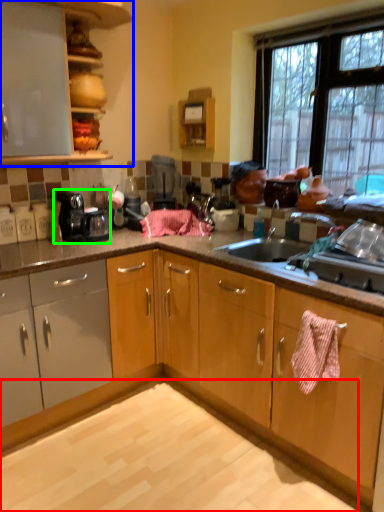
Question: Considering the real-world distances, which object is farthest from granite (highlighted by a red box)? cabinetry (highlighted by a blue box) or home appliance (highlighted by a green box)?

Choices:
 (A) cabinetry
 (B) home appliance

Answer: (A)